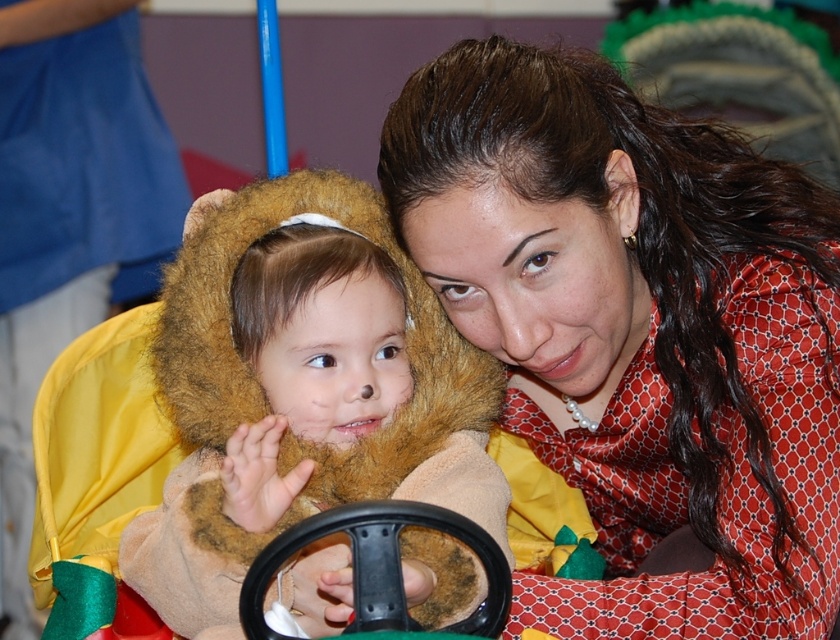
You are designing a photo frame that needs to fit both the smooth red blouse at upper right and the fuzzy brown bear at center. Since the frame has a fixed width, which object should be placed first to ensure both fit without overlapping?

The smooth red blouse at upper right has a larger width than the fuzzy brown bear at center, so place it first to accommodate its greater width before positioning the smaller fuzzy brown bear at center.

You are standing at the origin point in the image. There are two points marked in the scene. The first point is at coordinate point (x=756, y=518) and the second is at point (x=329, y=481). If you want to reach the point that is further away from you, which coordinate should you head towards?

Point (x=756, y=518) is behind point (x=329, y=481), so you should head towards point (x=756, y=518) to reach the one that is further away from you.